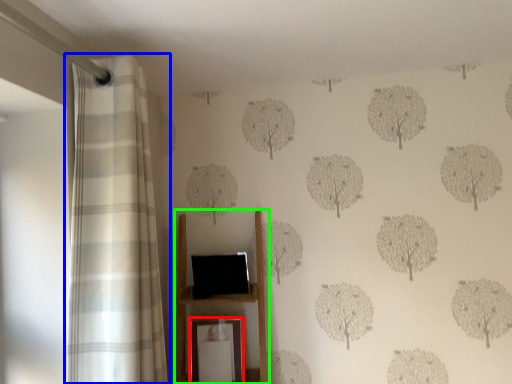
Question: Which object is the closest to the picture frame (highlighted by a red box)? Choose among these: curtain (highlighted by a blue box) or furniture (highlighted by a green box).

Choices:
 (A) curtain
 (B) furniture

Answer: (B)